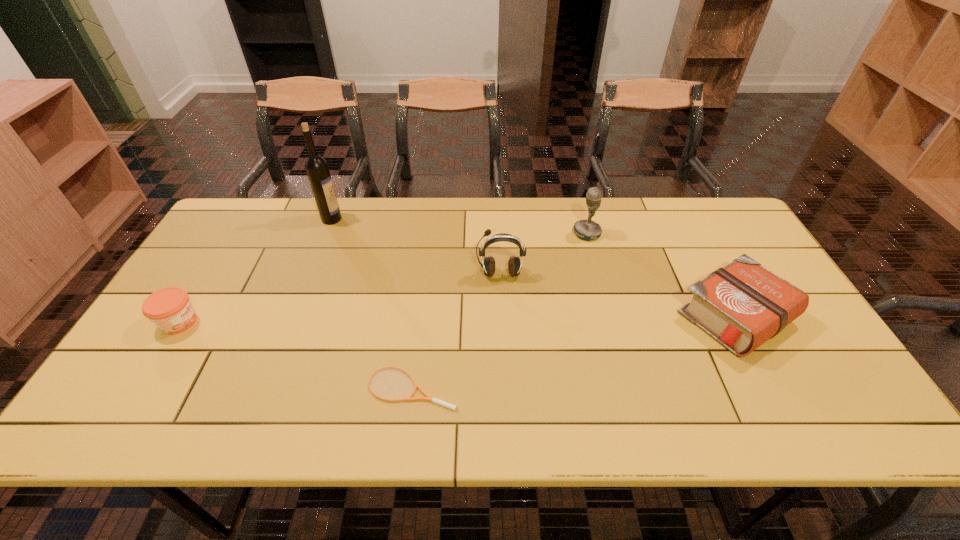
You are a GUI agent. You are given a task and a screenshot of the screen. Output one action in this format:
    pyautogui.click(x=<x>, y=<y>)
    Task: Click on the free region located on the front-facing side of the second object from right to left
    The height and width of the screenshot is (540, 960).
    Given the screenshot: What is the action you would take?
    pyautogui.click(x=548, y=233)

Locate an element on the screen. free space located 0.100m on the front-facing side of the second object from right to left is located at coordinates (541, 233).

Image resolution: width=960 pixels, height=540 pixels. Identify the location of vacant region located 0.290m on the front-facing side of the second object from right to left. (482, 233).

Locate an element on the screen. The height and width of the screenshot is (540, 960). vacant space situated on the ear pads of the earphone is located at coordinates (501, 300).

Find the location of a particular element. This screenshot has width=960, height=540. free space located on the back of the rightmost object is located at coordinates (680, 213).

At what (x,y) coordinates should I click in order to perform the action: click on free spot located 0.090m on the front label of the leftmost object. Please return your answer as a coordinate pair (x, y). The width and height of the screenshot is (960, 540). Looking at the image, I should click on (233, 322).

Find the location of `vacant area situated on the back of the tennis racket`. vacant area situated on the back of the tennis racket is located at coordinates (424, 289).

In order to click on wine bottle present at the far edge in this screenshot , I will do `click(316, 167)`.

Locate an element on the screen. microphone at the far edge is located at coordinates (587, 229).

The image size is (960, 540). Identify the location of object present at the near edge. (428, 398).